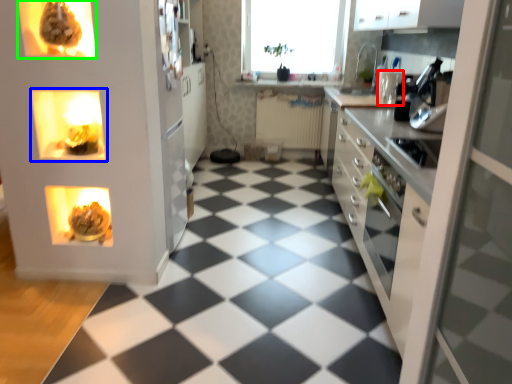
Question: Estimate the real-world distances between objects in this image. Which object is farther from appliance (highlighted by a red box), shelf (highlighted by a blue box) or appliance (highlighted by a green box)?

Choices:
 (A) shelf
 (B) appliance

Answer: (B)